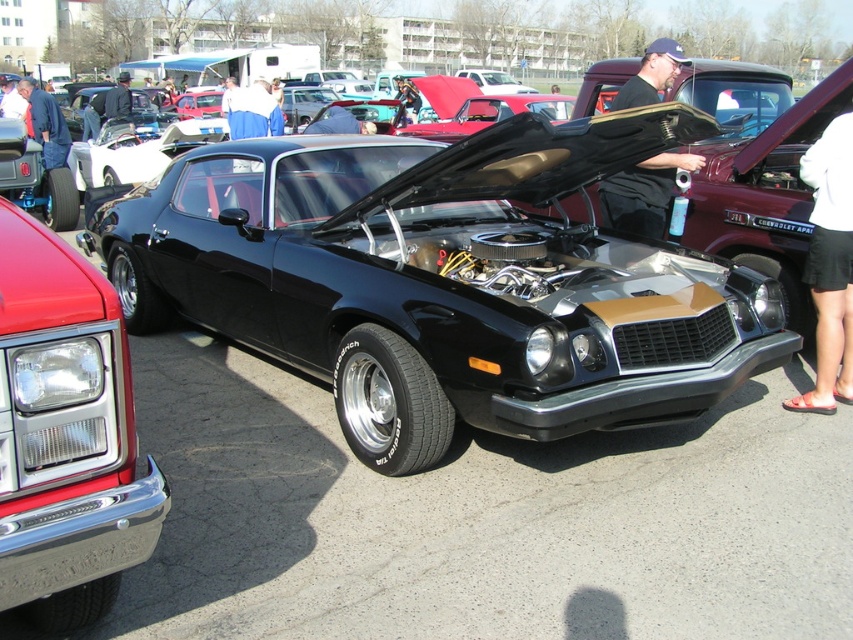
Can you confirm if blue denim jacket at upper left is positioned to the right of dark blue jacket at upper left?

Indeed, blue denim jacket at upper left is positioned on the right side of dark blue jacket at upper left.

Looking at this image, is the position of blue denim jacket at upper left more distant than that of dark blue jacket at upper left?

No, it is not.

Which is behind, point (24, 83) or point (109, 88)?

The point (109, 88) is behind.

Identify the location of blue denim jacket at upper left. This screenshot has height=640, width=853. (45, 124).

Does shiny chrome bumper at lower left have a greater height compared to blue denim jacket at upper left?

Correct, shiny chrome bumper at lower left is much taller as blue denim jacket at upper left.

Can you confirm if shiny chrome bumper at lower left is positioned above blue denim jacket at upper left?

Actually, shiny chrome bumper at lower left is below blue denim jacket at upper left.

Does point (64, 304) lie behind point (50, 164)?

No, it is not.

The image size is (853, 640). I want to click on shiny chrome bumper at lower left, so click(x=65, y=435).

Based on the photo, can you confirm if shiny chrome bumper at lower left is positioned to the right of black fabric shirt at upper center?

No, shiny chrome bumper at lower left is not to the right of black fabric shirt at upper center.

The width and height of the screenshot is (853, 640). Describe the element at coordinates (65, 435) in the screenshot. I see `shiny chrome bumper at lower left` at that location.

Who is more distant from viewer, [44,225] or [663,83]?

The point [663,83] is more distant.

This screenshot has height=640, width=853. Find the location of `shiny chrome bumper at lower left`. shiny chrome bumper at lower left is located at coordinates (65, 435).